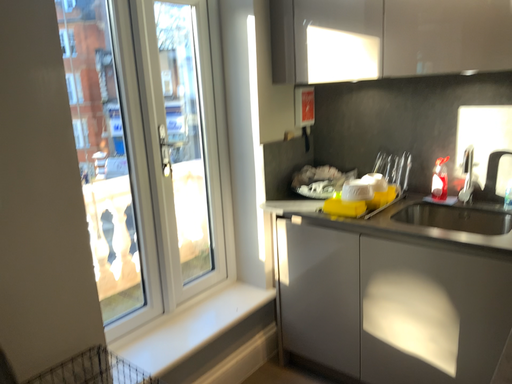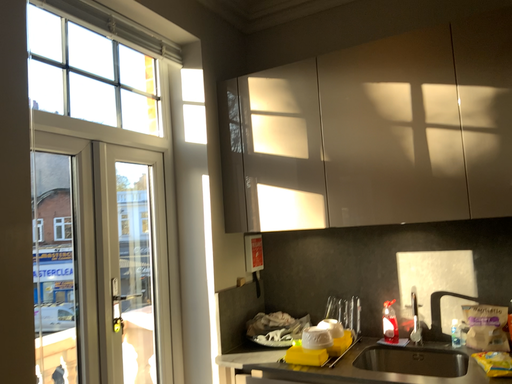
Question: Which way did the camera rotate in the video?

Choices:
 (A) rotated left
 (B) rotated right

Answer: (B)